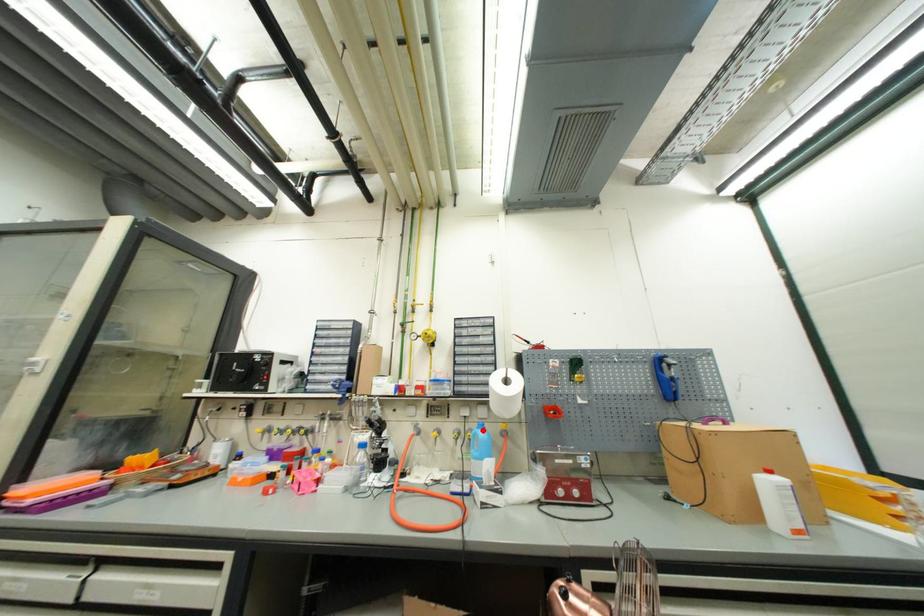
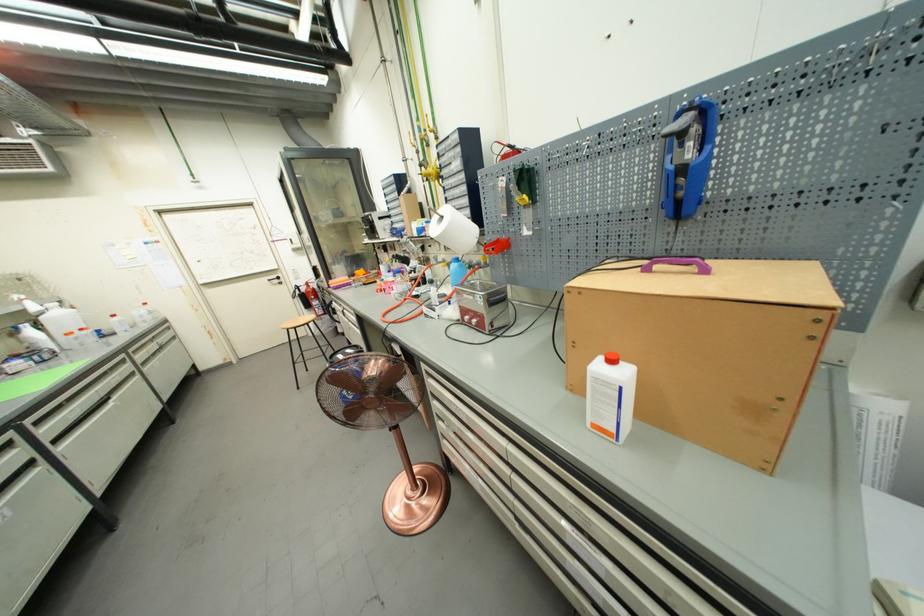
In the second image, find the point that corresponds to the highlighted location in the first image.

(458, 264)